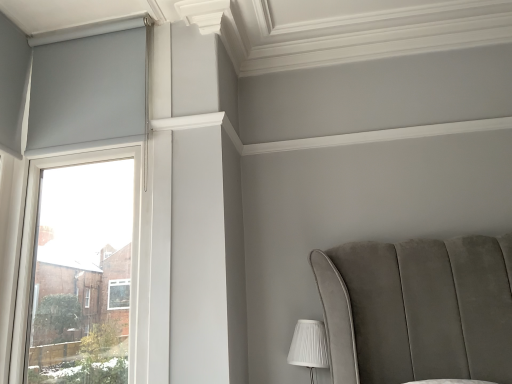
The image size is (512, 384). Identify the location of white pleated fabric at lower right. (309, 346).

What do you see at coordinates (309, 346) in the screenshot? I see `white pleated fabric at lower right` at bounding box center [309, 346].

Measure the distance between point (314, 348) and camera.

Point (314, 348) is 6.42 feet away from camera.

This screenshot has width=512, height=384. What do you see at coordinates (34, 237) in the screenshot? I see `matte gray roller blind at left` at bounding box center [34, 237].

Find the location of `matte gray roller blind at left`. matte gray roller blind at left is located at coordinates (34, 237).

This screenshot has height=384, width=512. What are the coordinates of `white pleated fabric at lower right` in the screenshot? It's located at (309, 346).

Considering the positions of objects matte gray roller blind at left and white pleated fabric at lower right in the image provided, who is more to the right, matte gray roller blind at left or white pleated fabric at lower right?

From the viewer's perspective, white pleated fabric at lower right appears more on the right side.

Is matte gray roller blind at left in front of or behind white pleated fabric at lower right in the image?

matte gray roller blind at left is in front of white pleated fabric at lower right.

Between point (28, 305) and point (300, 324), which one is positioned in front?

Positioned in front is point (28, 305).

From the image's perspective, which is above, matte gray roller blind at left or white pleated fabric at lower right?

matte gray roller blind at left, from the image's perspective.

From a real-world perspective, does matte gray roller blind at left stand above white pleated fabric at lower right?

Yes, from a real-world perspective, matte gray roller blind at left is over white pleated fabric at lower right

Considering the relative sizes of matte gray roller blind at left and white pleated fabric at lower right in the image provided, is matte gray roller blind at left thinner than white pleated fabric at lower right?

Indeed, matte gray roller blind at left has a lesser width compared to white pleated fabric at lower right.

Is matte gray roller blind at left taller or shorter than white pleated fabric at lower right?

Considering their sizes, matte gray roller blind at left has more height than white pleated fabric at lower right.

Considering the relative sizes of matte gray roller blind at left and white pleated fabric at lower right in the image provided, is matte gray roller blind at left smaller than white pleated fabric at lower right?

No, matte gray roller blind at left is not smaller than white pleated fabric at lower right.

Is white pleated fabric at lower right completely or partially inside matte gray roller blind at left?

No, white pleated fabric at lower right is not a part of matte gray roller blind at left.

Are matte gray roller blind at left and white pleated fabric at lower right beside each other?

No, matte gray roller blind at left is not touching white pleated fabric at lower right.

Could you tell me if matte gray roller blind at left is facing white pleated fabric at lower right?

No, matte gray roller blind at left is not aimed at white pleated fabric at lower right.

How different are the orientations of matte gray roller blind at left and white pleated fabric at lower right in degrees?

matte gray roller blind at left and white pleated fabric at lower right are facing 0.0391 degrees away from each other.

In order to click on table lamp behind the matte gray roller blind at left in this screenshot , I will do click(309, 346).

Considering the positions of objects white pleated fabric at lower right and matte gray roller blind at left in the image provided, who is more to the right, white pleated fabric at lower right or matte gray roller blind at left?

From the viewer's perspective, white pleated fabric at lower right appears more on the right side.

Which is in front, white pleated fabric at lower right or matte gray roller blind at left?

matte gray roller blind at left is more forward.

Is point (324, 354) farther from viewer compared to point (22, 252)?

No.

From the image's perspective, between white pleated fabric at lower right and matte gray roller blind at left, which one is located above?

From the image's view, matte gray roller blind at left is above.

Consider the image. From a real-world perspective, is white pleated fabric at lower right on matte gray roller blind at left?

Incorrect, from a real-world perspective, white pleated fabric at lower right is lower than matte gray roller blind at left.

Is white pleated fabric at lower right wider than matte gray roller blind at left?

Yes, white pleated fabric at lower right is wider than matte gray roller blind at left.

Who is taller, white pleated fabric at lower right or matte gray roller blind at left?

matte gray roller blind at left is taller.

Does white pleated fabric at lower right have a larger size compared to matte gray roller blind at left?

No.

Is matte gray roller blind at left completely or partially inside white pleated fabric at lower right?

No, matte gray roller blind at left is not inside white pleated fabric at lower right.

Would you consider white pleated fabric at lower right to be distant from matte gray roller blind at left?

Yes.

Is white pleated fabric at lower right turned away from matte gray roller blind at left?

white pleated fabric at lower right does not have its back to matte gray roller blind at left.

How many degrees apart are the facing directions of white pleated fabric at lower right and matte gray roller blind at left?

There is a 0.0391-degree angle between the facing directions of white pleated fabric at lower right and matte gray roller blind at left.

You are a GUI agent. You are given a task and a screenshot of the screen. Output one action in this format:
    pyautogui.click(x=<x>, y=<y>)
    Task: Click on the window in front of the white pleated fabric at lower right
    
    Given the screenshot: What is the action you would take?
    pyautogui.click(x=34, y=237)

You are a GUI agent. You are given a task and a screenshot of the screen. Output one action in this format:
    pyautogui.click(x=<x>, y=<y>)
    Task: Click on the table lamp that is below the matte gray roller blind at left (from the image's perspective)
    Image resolution: width=512 pixels, height=384 pixels.
    Given the screenshot: What is the action you would take?
    pyautogui.click(x=309, y=346)

Locate an element on the screen. Image resolution: width=512 pixels, height=384 pixels. window above the white pleated fabric at lower right (from a real-world perspective) is located at coordinates 34,237.